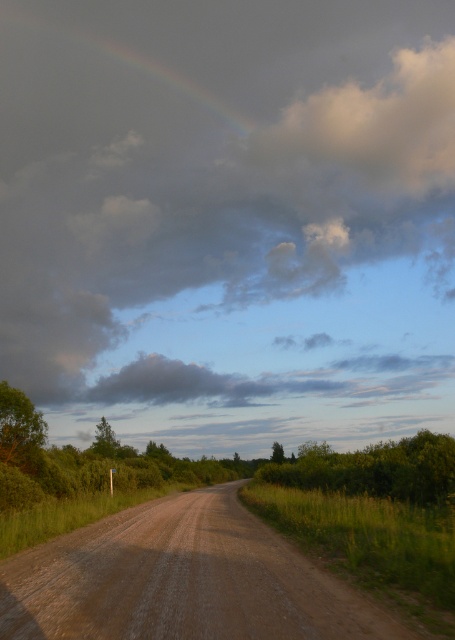
You are an artist painting the sky in this rural scene. You have to decide where to place the cloudy at upper center and rainbow at upper center. Which one should you make larger in your painting?

The cloudy at upper center should be made larger than the rainbow at upper center because the cloudy at upper center has a larger size compared to rainbow at upper center according to the description.

Based on the photo, you are a photographer planning to capture the entire scene in one shot. Given that the cloudy at upper center is wider than the brown gravel road at center, which object should you focus on to ensure both are visible without cropping?

To ensure both the cloudy at upper center and the brown gravel road at center are visible without cropping, focus on the cloudy at upper center since it is wider and requires more space in the frame.

You are driving a car and see the brown gravel road at center and the rainbow at upper center in the distance. Which object is located to the left of the other?

The brown gravel road at center is positioned on the right side of rainbow at upper center, so the rainbow at upper center is to the left of the brown gravel road at center.